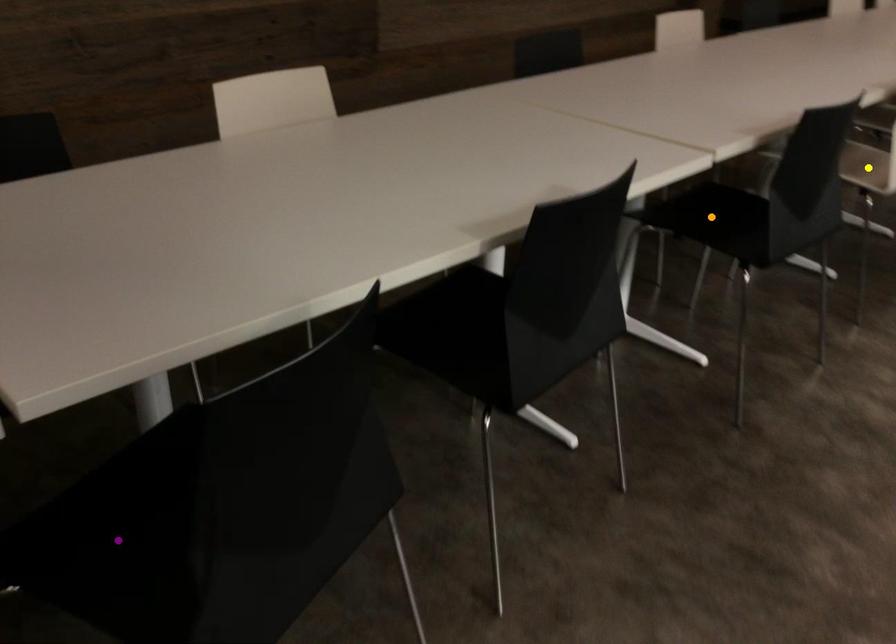
Order these from nearest to farthest:
1. purple point
2. yellow point
3. orange point

purple point → orange point → yellow point